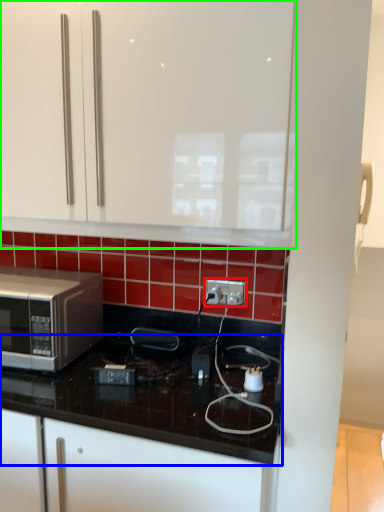
Question: Based on their relative distances, which object is nearer to electric outlet (highlighted by a red box)? Choose from countertop (highlighted by a blue box) and cabinetry (highlighted by a green box).

Choices:
 (A) countertop
 (B) cabinetry

Answer: (A)